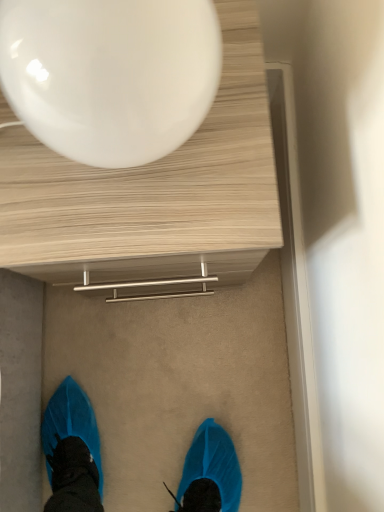
Where is `vacant area on top of wooden table at upper center (from a real-world perspective)`? vacant area on top of wooden table at upper center (from a real-world perspective) is located at coordinates (123, 174).